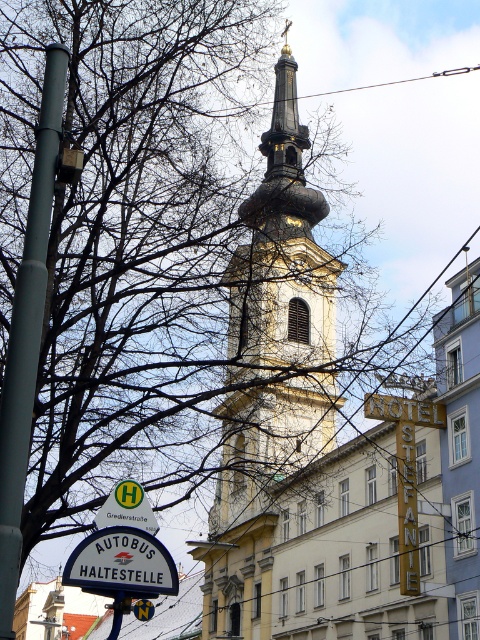
Is point (132, 593) more distant than point (452, 68)?

That is False.

Is white plastic sign at lower left bigger than metallic wire at upper center?

No, white plastic sign at lower left is not bigger than metallic wire at upper center.

Describe the element at coordinates (121, 564) in the screenshot. Image resolution: width=480 pixels, height=640 pixels. I see `white plastic sign at lower left` at that location.

I want to click on white plastic sign at lower left, so click(x=121, y=564).

Can you confirm if yellow stone church at center is smaller than golden stone church tower at center?

Indeed, yellow stone church at center has a smaller size compared to golden stone church tower at center.

Does yellow stone church at center lie in front of golden stone church tower at center?

Yes, it is in front of golden stone church tower at center.

Measure the distance between yellow stone church at center and camera.

yellow stone church at center and camera are 71.65 meters apart from each other.

The image size is (480, 640). Identify the location of yellow stone church at center. (370, 516).

Which is below, yellow stone church at center or metallic wire at upper center?

yellow stone church at center is lower down.

Who is positioned more to the right, yellow stone church at center or metallic wire at upper center?

From the viewer's perspective, metallic wire at upper center appears more on the right side.

What do you see at coordinates (370, 516) in the screenshot? This screenshot has height=640, width=480. I see `yellow stone church at center` at bounding box center [370, 516].

Find the location of `yellow stone church at center`. yellow stone church at center is located at coordinates (370, 516).